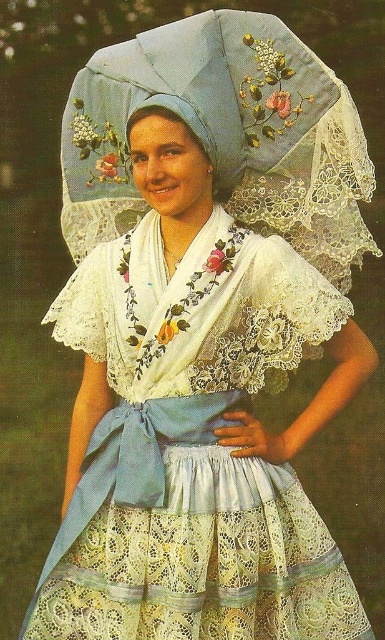
You are attending a cultural festival and see the lace fabric umbrella at upper center and the light blue lace headdress at center. Which object is taller?

The lace fabric umbrella at upper center is taller than the light blue lace headdress at center.